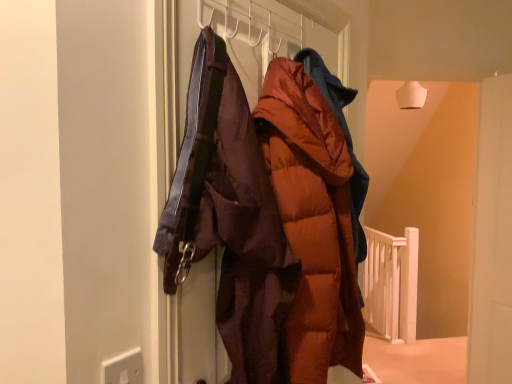
Question: Is matte brown puffer jacket at center taller or shorter than white wooden rail at lower right?

Choices:
 (A) tall
 (B) short

Answer: (B)

Question: Is point (352, 206) closer or farther from the camera than point (369, 241)?

Choices:
 (A) closer
 (B) farther

Answer: (A)

Question: Which is nearer to the matte brown puffer jacket at center?

Choices:
 (A) orange puffy coat at center
 (B) white plastic electric outlet at lower left
 (C) white wooden rail at lower right

Answer: (A)

Question: Which object is the farthest from the orange puffy coat at center?

Choices:
 (A) matte brown puffer jacket at center
 (B) white wooden rail at lower right
 (C) white plastic electric outlet at lower left

Answer: (B)